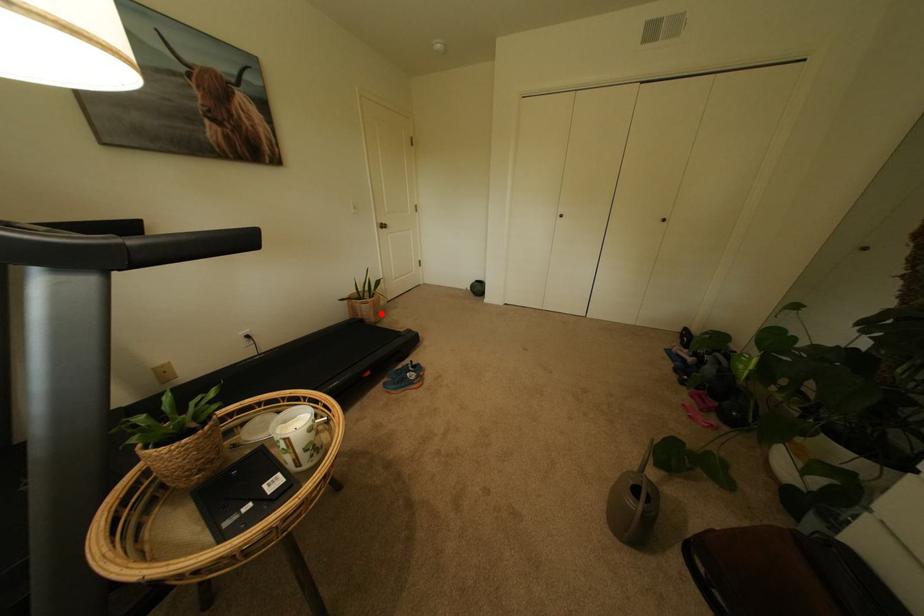
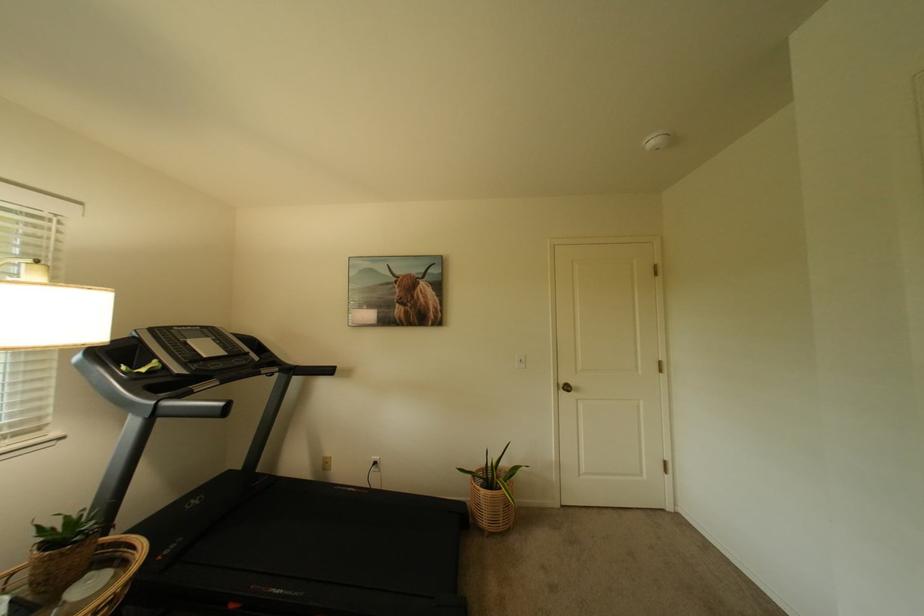
Locate, in the second image, the point that corresponds to the highlighted location in the first image.

(495, 515)